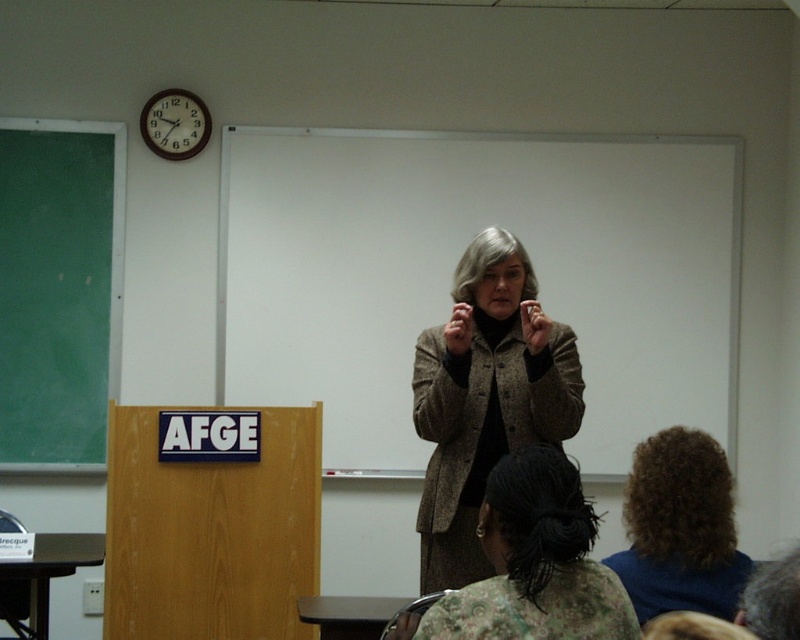
You are a student sitting in the classroom. You need to write down a note about the presentation. Which object should you look at first, the green chalkboard at left or the gray matte wig at center?

The green chalkboard at left is to the left of the gray matte wig at center, so you should look at the green chalkboard at left first since it is positioned to the left of the gray matte wig at center.

You are an attendee in the classroom. You need to write a note on the green chalkboard at left and then adjust the gray matte wig at center. Which task can you do first without moving from your current position?

The green chalkboard at left has a greater width than the gray matte wig at center, so you can write a note on the green chalkboard at left first without moving from your current position since it is wider and more accessible.

You are an attendee in the classroom. The presenter is using two items at the center. Which one is wider between the white matte board at center and the gray matte wig at center?

The white matte board at center is wider than the gray matte wig at center according to the description.